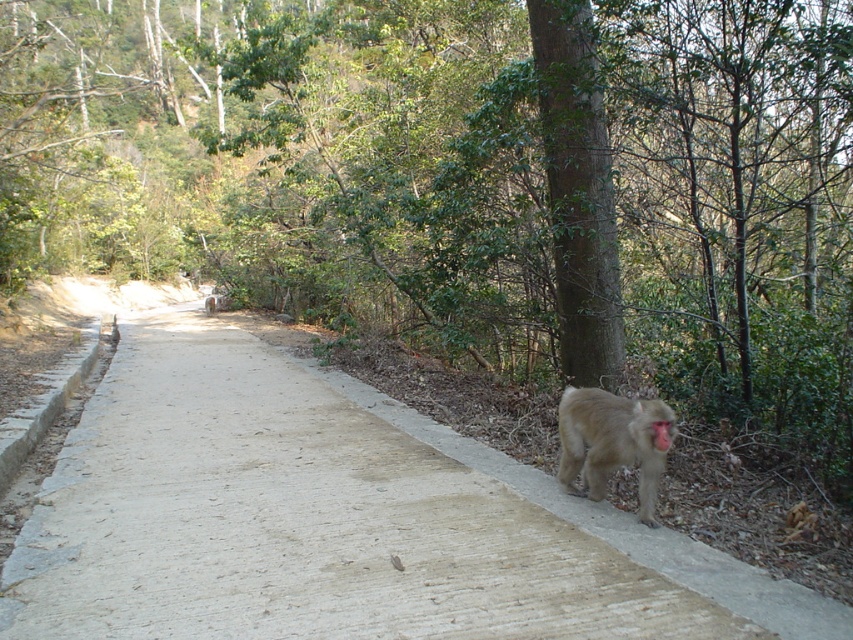
Who is positioned more to the left, gray concrete pavement at center or pink fur monkey at lower right?

Positioned to the left is gray concrete pavement at center.

Does gray concrete pavement at center appear on the right side of pink fur monkey at lower right?

Incorrect, gray concrete pavement at center is not on the right side of pink fur monkey at lower right.

Is point (314, 444) farther from viewer compared to point (654, 444)?

Yes.

At what (x,y) coordinates should I click in order to perform the action: click on gray concrete pavement at center. Please return your answer as a coordinate pair (x, y). The height and width of the screenshot is (640, 853). Looking at the image, I should click on click(x=299, y=518).

What do you see at coordinates (299, 518) in the screenshot? I see `gray concrete pavement at center` at bounding box center [299, 518].

Does gray concrete pavement at center have a greater height compared to gray fur monkey at lower right?

No, gray concrete pavement at center is not taller than gray fur monkey at lower right.

Between point (601, 579) and point (570, 442), which one is positioned in front?

Point (601, 579)

What are the coordinates of `gray concrete pavement at center` in the screenshot? It's located at (299, 518).

Does gray fur monkey at lower right have a lesser width compared to pink fur monkey at lower right?

In fact, gray fur monkey at lower right might be wider than pink fur monkey at lower right.

Between gray fur monkey at lower right and pink fur monkey at lower right, which one is positioned lower?

gray fur monkey at lower right

Is point (595, 490) behind point (654, 442)?

Yes.

You are a GUI agent. You are given a task and a screenshot of the screen. Output one action in this format:
    pyautogui.click(x=<x>, y=<y>)
    Task: Click on the gray fur monkey at lower right
    Image resolution: width=853 pixels, height=640 pixels.
    Given the screenshot: What is the action you would take?
    pyautogui.click(x=610, y=442)